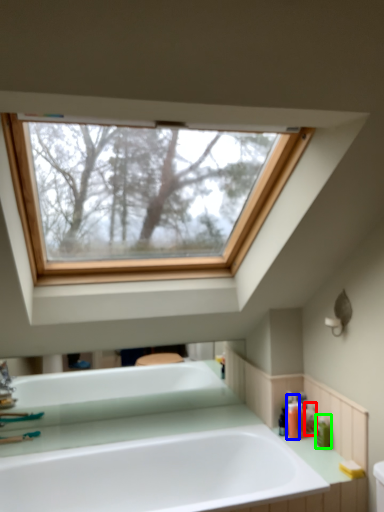
Question: Which object is positioned farthest from toiletry (highlighted by a red box)? Select from toiletry (highlighted by a blue box) and toiletry (highlighted by a green box).

Choices:
 (A) toiletry
 (B) toiletry

Answer: (A)